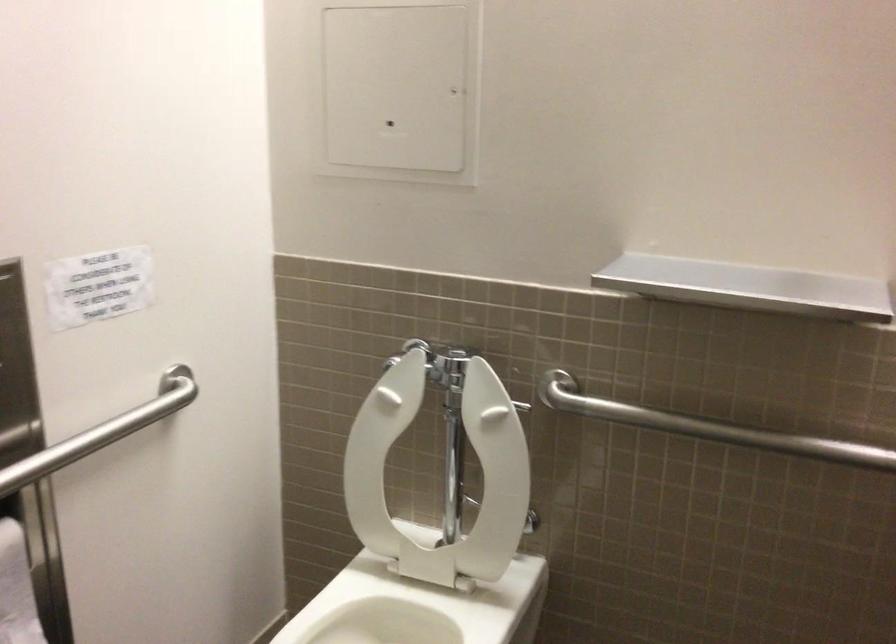
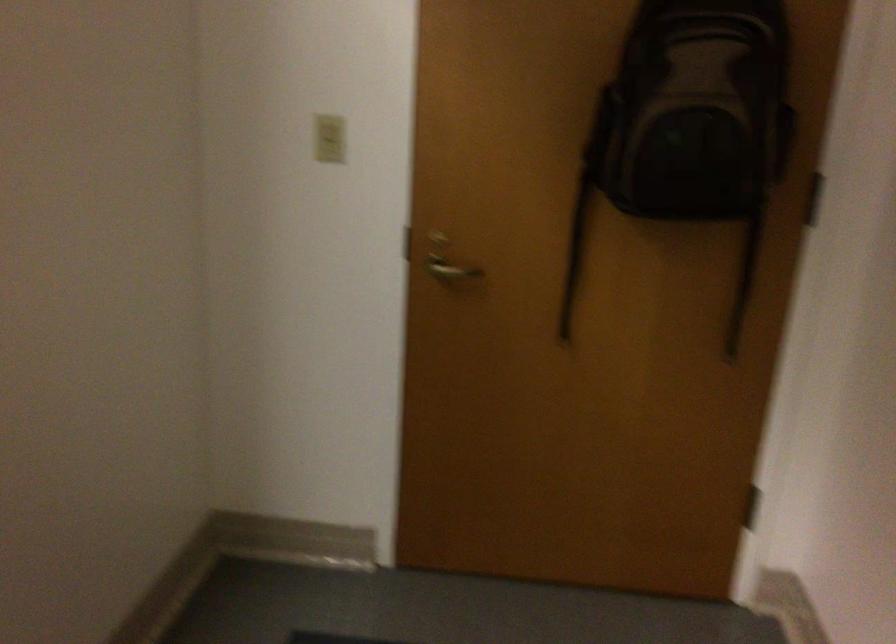
The images are taken continuously from a first-person perspective. In which direction is your viewpoint rotating?

The camera rotated toward right-down.